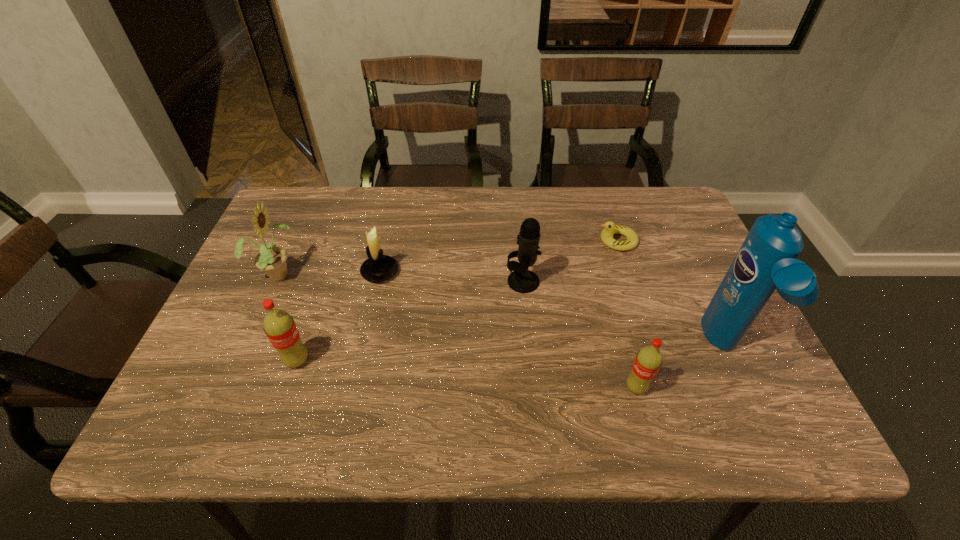
Where is `object at the far edge`? Image resolution: width=960 pixels, height=540 pixels. object at the far edge is located at coordinates (610, 228).

Find the location of a particular element. The image size is (960, 540). shampoo that is at the near edge is located at coordinates (767, 260).

Find the location of a particular element. This screenshot has height=540, width=960. object that is at the left edge is located at coordinates (272, 260).

Where is `object that is at the right edge`? object that is at the right edge is located at coordinates (767, 260).

Identify the location of object that is at the near right corner. (767, 260).

The image size is (960, 540). What are the coordinates of `vacant space at the far edge` in the screenshot? It's located at click(x=623, y=222).

The height and width of the screenshot is (540, 960). Identify the location of free space at the near edge. (329, 386).

You are a GUI agent. You are given a task and a screenshot of the screen. Output one action in this format:
    pyautogui.click(x=<x>, y=<y>)
    Task: Click on the vacant area at the left edge
    
    Given the screenshot: What is the action you would take?
    pyautogui.click(x=252, y=342)

Where is `vacant region at the right edge of the desktop`? vacant region at the right edge of the desktop is located at coordinates (655, 255).

The image size is (960, 540). I want to click on free point at the far left corner, so click(295, 187).